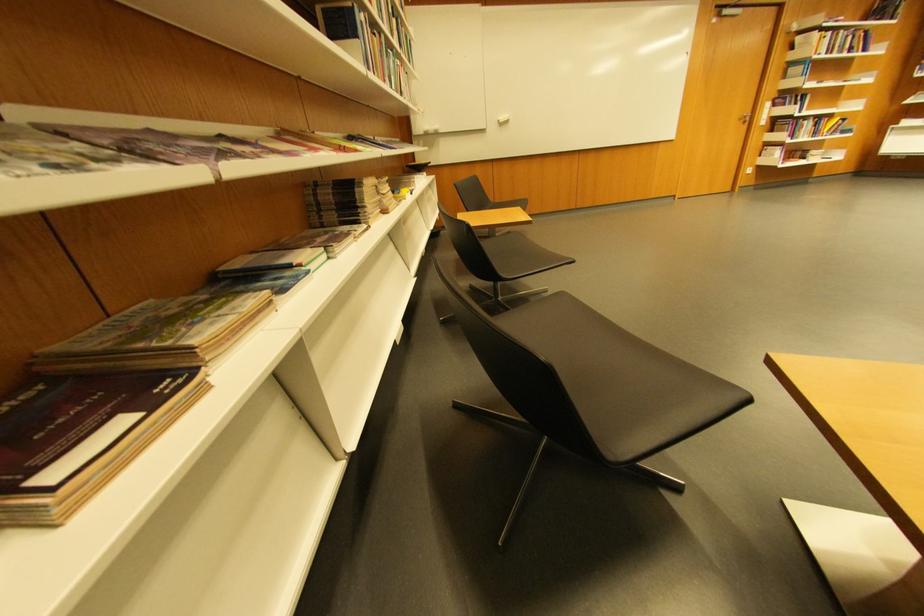
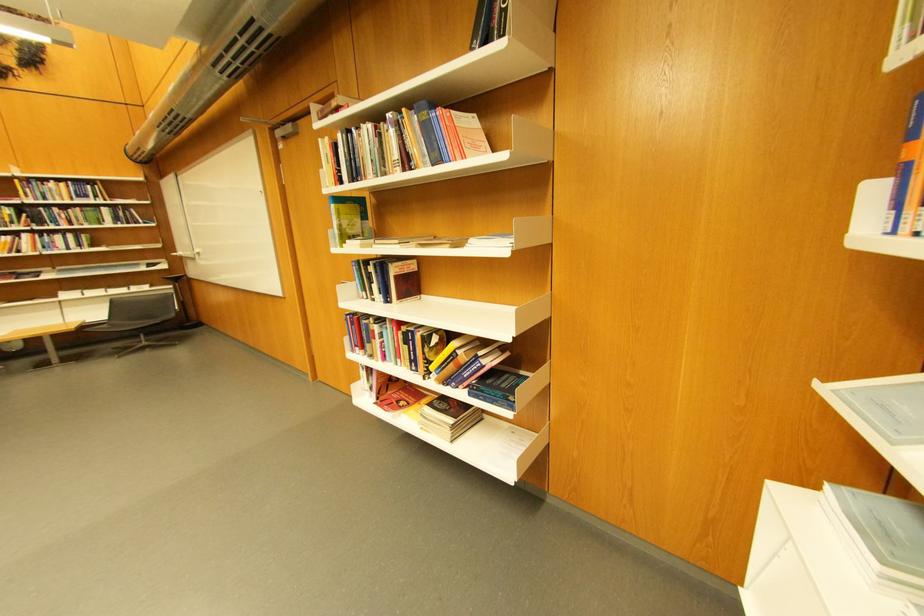
Locate, in the second image, the point that corresponds to pixel 451 132 in the first image.

(195, 257)